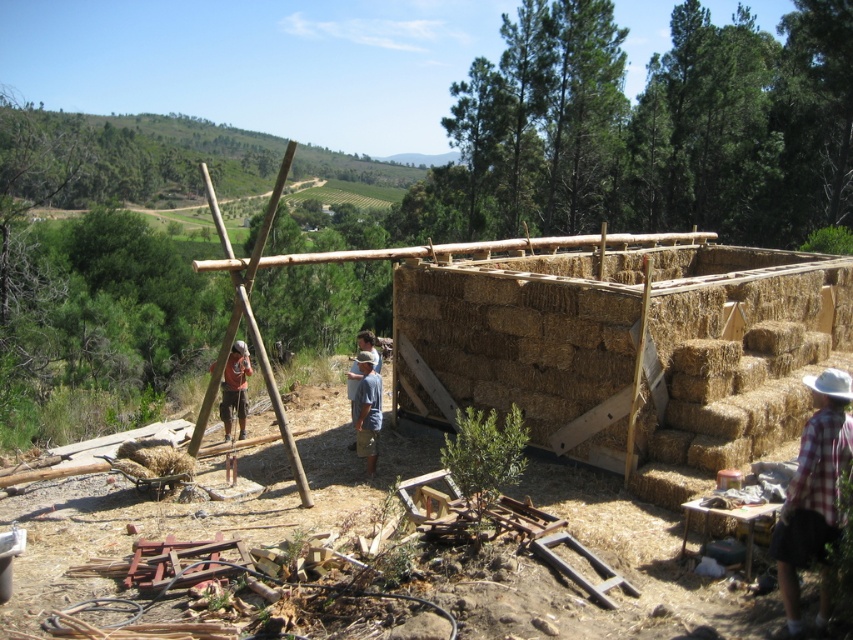
Is point (368, 448) farther from camera compared to point (233, 384)?

No.

What do you see at coordinates (367, 410) in the screenshot?
I see `blue denim jeans at center` at bounding box center [367, 410].

Is point (361, 371) positioned after point (233, 374)?

No.

This screenshot has width=853, height=640. I want to click on blue denim jeans at center, so click(x=367, y=410).

Who is positioned more to the left, plaid fabric shirt at lower right or blue denim jeans at center?

From the viewer's perspective, blue denim jeans at center appears more on the left side.

Is point (837, 385) positioned after point (358, 413)?

No, it is in front of (358, 413).

Where is `plaid fabric shirt at lower right`? plaid fabric shirt at lower right is located at coordinates (813, 493).

Who is positioned more to the right, plaid fabric shirt at lower right or brown wood construction worker at center?

Positioned to the right is plaid fabric shirt at lower right.

Is plaid fabric shirt at lower right behind brown wood construction worker at center?

No, it is not.

The height and width of the screenshot is (640, 853). I want to click on plaid fabric shirt at lower right, so click(813, 493).